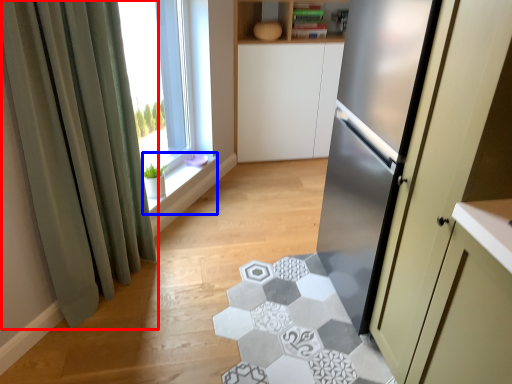
Question: Which point is further to the camera, curtain (highlighted by a red box) or window sill (highlighted by a blue box)?

Choices:
 (A) curtain
 (B) window sill

Answer: (B)